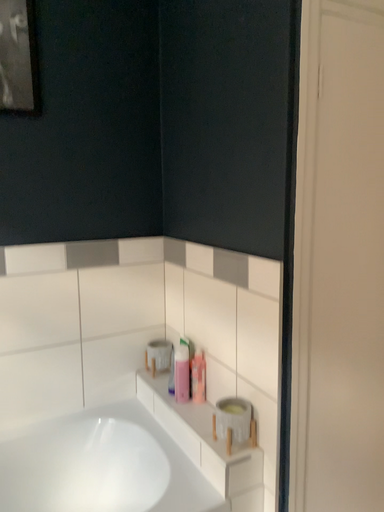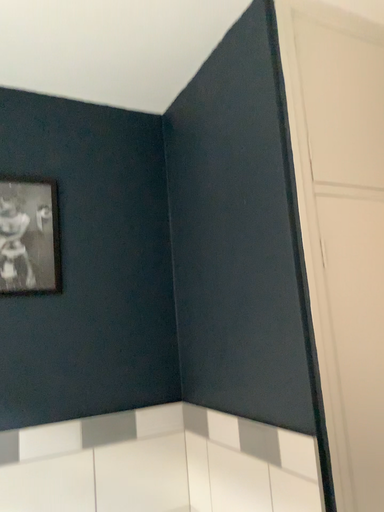
Question: Which way did the camera rotate in the video?

Choices:
 (A) rotated upward
 (B) rotated downward

Answer: (A)